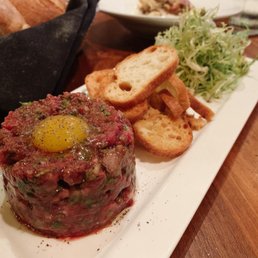
Find the location of `back white porcelain plate`. back white porcelain plate is located at coordinates (126, 5), (126, 244).